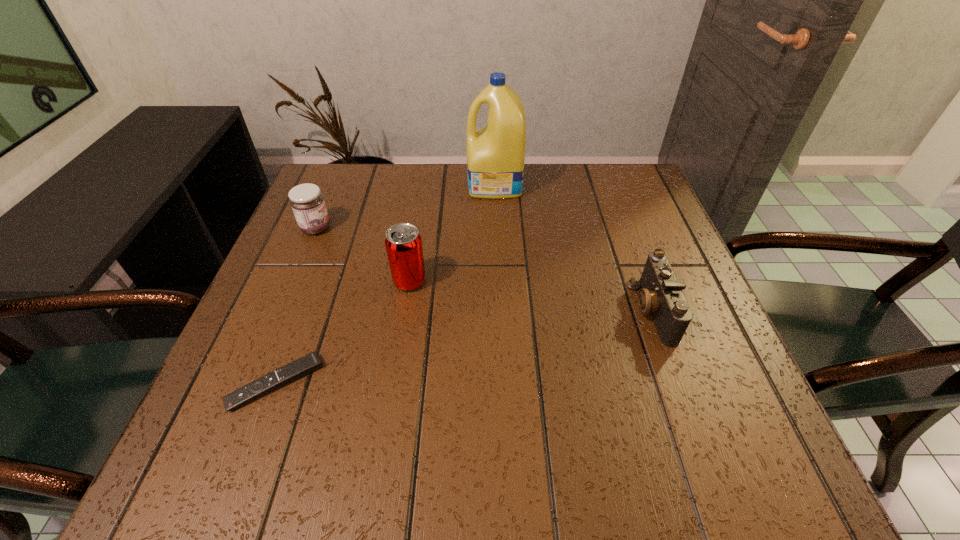
Find the location of a particular element. Image resolution: width=960 pixels, height=540 pixels. the tallest object is located at coordinates (496, 153).

Locate an element on the screen. This screenshot has height=540, width=960. the fourth object from left to right is located at coordinates (496, 153).

You are a GUI agent. You are given a task and a screenshot of the screen. Output one action in this format:
    pyautogui.click(x=<x>, y=<y>)
    Task: Click on the third object from right to left
    This screenshot has height=540, width=960.
    Given the screenshot: What is the action you would take?
    pyautogui.click(x=403, y=243)

The width and height of the screenshot is (960, 540). Find the location of `soda can`. soda can is located at coordinates (403, 243).

This screenshot has width=960, height=540. I want to click on jam, so click(306, 201).

Locate an element on the screen. the fourth tallest object is located at coordinates (661, 294).

Identify the location of camera. This screenshot has width=960, height=540. (661, 294).

Where is `the shortest object`? Image resolution: width=960 pixels, height=540 pixels. the shortest object is located at coordinates click(x=309, y=363).

You are a GUI agent. You are given a task and a screenshot of the screen. Output one action in this format:
    pyautogui.click(x=<x>, y=<y>)
    Task: Click on the nearest object
    
    Given the screenshot: What is the action you would take?
    pyautogui.click(x=309, y=363)

The width and height of the screenshot is (960, 540). In order to click on vacant area located 0.230m on the label of the farthest object in this screenshot , I will do `click(383, 185)`.